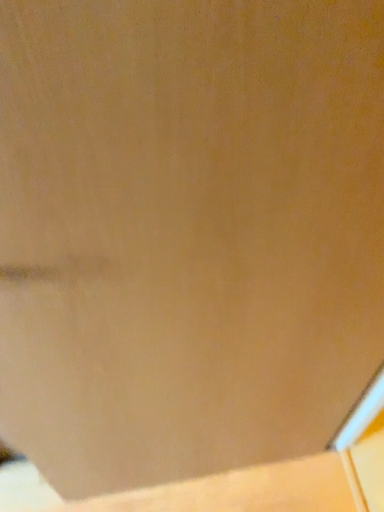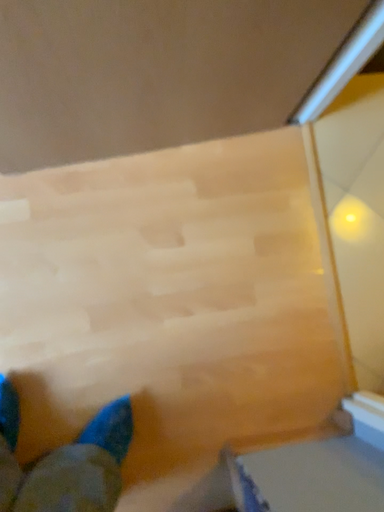
Question: How did the camera likely rotate when shooting the video?

Choices:
 (A) rotated downward
 (B) rotated upward

Answer: (A)